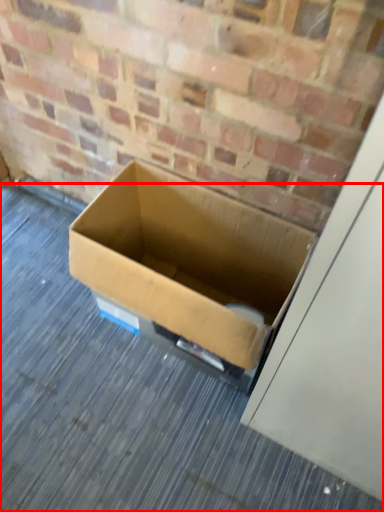
Question: From the image's perspective, considering the relative positions of alley (annotated by the red box) and box in the image provided, where is alley (annotated by the red box) located with respect to the staircase?

Choices:
 (A) above
 (B) below

Answer: (B)